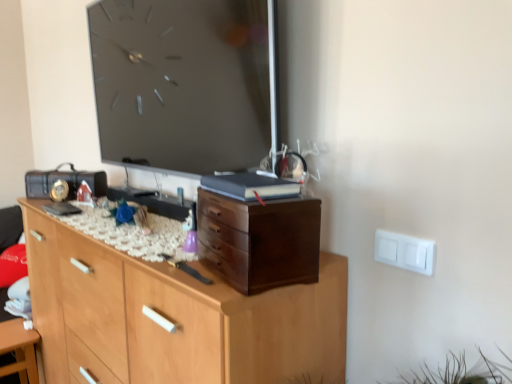
Question: Can you confirm if wooden chest of drawers at center, the first chest of drawers ordered from the bottom, is wider than white glossy table at lower left?

Choices:
 (A) no
 (B) yes

Answer: (B)

Question: Could you tell me if wooden chest of drawers at center, the first chest of drawers ordered from the bottom, is turned towards white glossy table at lower left?

Choices:
 (A) no
 (B) yes

Answer: (B)

Question: Is wooden chest of drawers at center, the first chest of drawers ordered from the bottom, shorter than white glossy table at lower left?

Choices:
 (A) no
 (B) yes

Answer: (A)

Question: Is wooden chest of drawers at center, the first chest of drawers ordered from the bottom, to the right of white glossy table at lower left from the viewer's perspective?

Choices:
 (A) yes
 (B) no

Answer: (A)

Question: Does wooden chest of drawers at center, arranged as the second chest of drawers when viewed from the top, appear on the left side of white glossy table at lower left?

Choices:
 (A) no
 (B) yes

Answer: (A)

Question: Can you confirm if wooden chest of drawers at center, the first chest of drawers ordered from the bottom, is bigger than white glossy table at lower left?

Choices:
 (A) no
 (B) yes

Answer: (B)

Question: Considering the relative sizes of white glossy table at lower left and wooden chest of drawers at center, the first chest of drawers ordered from the bottom, in the image provided, is white glossy table at lower left smaller than wooden chest of drawers at center, the first chest of drawers ordered from the bottom,?

Choices:
 (A) yes
 (B) no

Answer: (A)

Question: Is white glossy table at lower left oriented towards wooden chest of drawers at center, arranged as the second chest of drawers when viewed from the top?

Choices:
 (A) no
 (B) yes

Answer: (A)

Question: Are white glossy table at lower left and wooden chest of drawers at center, arranged as the second chest of drawers when viewed from the top, located far from each other?

Choices:
 (A) yes
 (B) no

Answer: (B)

Question: Does white glossy table at lower left have a larger size compared to wooden chest of drawers at center, the first chest of drawers ordered from the bottom?

Choices:
 (A) no
 (B) yes

Answer: (A)

Question: Is white glossy table at lower left to the left of wooden chest of drawers at center, arranged as the second chest of drawers when viewed from the top, from the viewer's perspective?

Choices:
 (A) no
 (B) yes

Answer: (B)

Question: From a real-world perspective, is white glossy table at lower left under wooden chest of drawers at center, arranged as the second chest of drawers when viewed from the top?

Choices:
 (A) yes
 (B) no

Answer: (A)

Question: Considering the relative sizes of white glossy table at lower left and dark wood chest of drawers at center, placed as the 1th chest of drawers when sorted from top to bottom, in the image provided, is white glossy table at lower left wider than dark wood chest of drawers at center, placed as the 1th chest of drawers when sorted from top to bottom,?

Choices:
 (A) yes
 (B) no

Answer: (B)